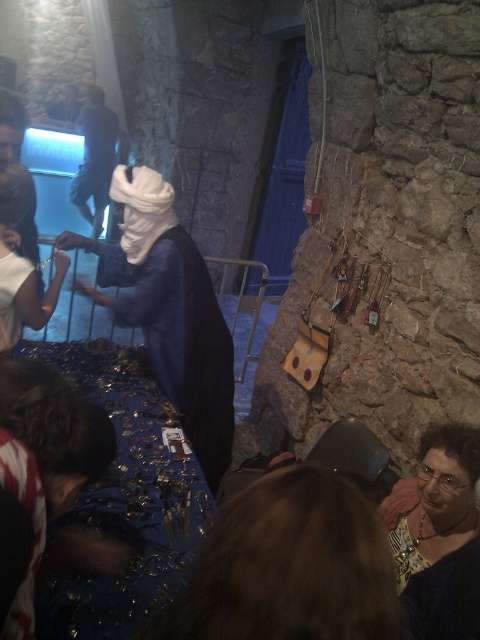
You are standing in front of the table with jewelry and want to pick up an item located at point (459, 524) and another item at point (84, 116). Which item will be easier to reach without moving your position?

The item at point (459, 524) will be easier to reach because it is closer to the camera, meaning it is nearer to your current position compared to the item at point (84, 116).

You are a customer at a jewelry stall and want to pick up the matte gold necklace at lower right while holding the matte blue dress at center. Can you reach both items at the same time if your arms can extend 3 feet apart?

The matte blue dress at center and matte gold necklace at lower right are 3.91 feet apart. Since your arms can only extend 3 feet apart, you cannot reach both items at the same time.

You are a customer looking at the items on the table. You see the matte blue dress at center and the dark blue fabric at center. Which one is positioned to the right side of the table?

The matte blue dress at center is to the right of the dark blue fabric at center, so the matte blue dress at center is positioned to the right side of the table.